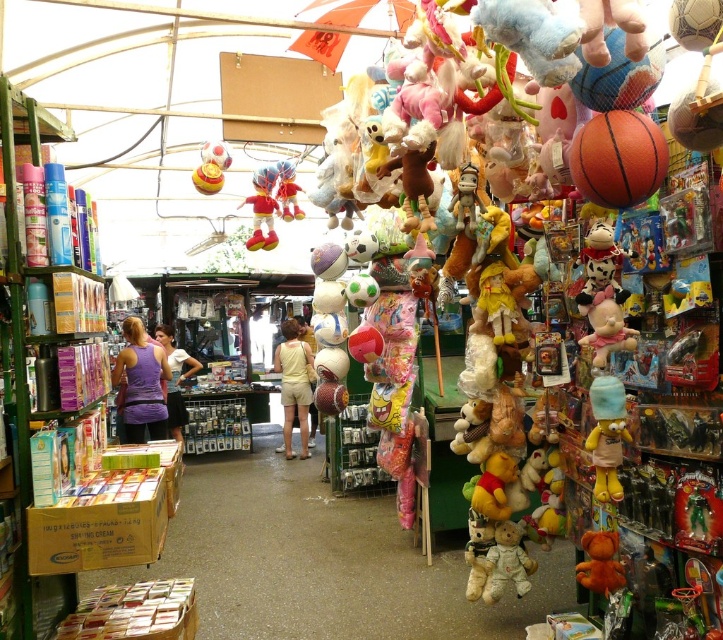
Question: Which of the following is the farthest from the observer?

Choices:
 (A) (153, 429)
 (B) (176, 436)
 (C) (515, 532)

Answer: (B)

Question: Which of these objects is positioned closest to the pink plush toy at right?

Choices:
 (A) fluffy orange teddy bear at lower right
 (B) shiny yellow rubber duck at center
 (C) yellow plush bear at right

Answer: (C)

Question: Can you confirm if yellow plush bear at right is positioned to the left of yellow cotton shorts at center?

Choices:
 (A) no
 (B) yes

Answer: (A)

Question: Does purple fabric tank top at center appear on the right side of pink plush toy at right?

Choices:
 (A) yes
 (B) no

Answer: (B)

Question: Where is purple fabric tank top at center located in relation to yellow plush bear at right in the image?

Choices:
 (A) left
 (B) right

Answer: (A)

Question: Based on their relative distances, which object is nearer to the pink plush toy at right?

Choices:
 (A) velvet plush toy at center
 (B) purple fabric shirt at center
 (C) soft beige teddy bear at lower center

Answer: (C)